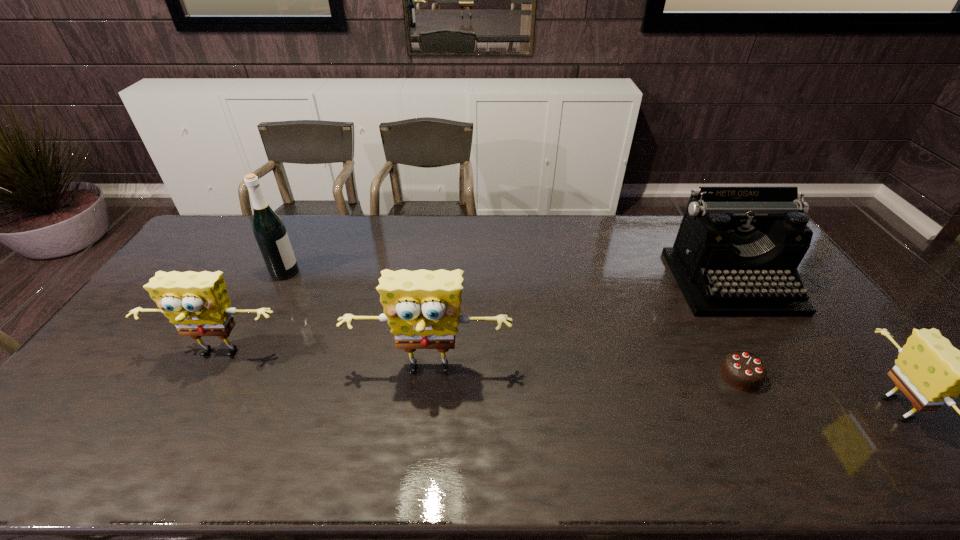
The image size is (960, 540). I want to click on vacant point located between the shortest object and the wine bottle, so click(513, 323).

Where is `object that ranks as the closest to the wine bottle`? This screenshot has width=960, height=540. object that ranks as the closest to the wine bottle is located at coordinates (197, 303).

Locate an element on the screen. This screenshot has height=540, width=960. object that is the second closest to the leftmost sponge is located at coordinates pos(269,230).

Locate which sponge ranks in proximity to the leftmost sponge. Please provide its 2D coordinates. Your answer should be formatted as a tuple, i.e. [(x, y)], where the tuple contains the x and y coordinates of a point satisfying the conditions above.

[(422, 307)]

Select which sponge is the second closest to the second shortest object. Please provide its 2D coordinates. Your answer should be formatted as a tuple, i.e. [(x, y)], where the tuple contains the x and y coordinates of a point satisfying the conditions above.

[(197, 303)]

The image size is (960, 540). I want to click on free spot that satisfies the following two spatial constraints: 1. on the label of the wine bottle; 2. on the left side of the chocolate cake, so click(231, 375).

This screenshot has height=540, width=960. Find the location of `vacant area in the image that satisfies the following two spatial constraints: 1. on the face of the third object from left to right; 2. on the right side of the chocolate cake`. vacant area in the image that satisfies the following two spatial constraints: 1. on the face of the third object from left to right; 2. on the right side of the chocolate cake is located at coordinates (429, 375).

Image resolution: width=960 pixels, height=540 pixels. In order to click on free region that satisfies the following two spatial constraints: 1. on the face of the chocolate cake; 2. on the left side of the second shortest sponge in this screenshot , I will do `click(208, 375)`.

At what (x,y) coordinates should I click in order to perform the action: click on vacant point that satisfies the following two spatial constraints: 1. on the face of the chocolate cake; 2. on the left side of the fourth object from right to left. Please return your answer as a coordinate pair (x, y). Looking at the image, I should click on (429, 375).